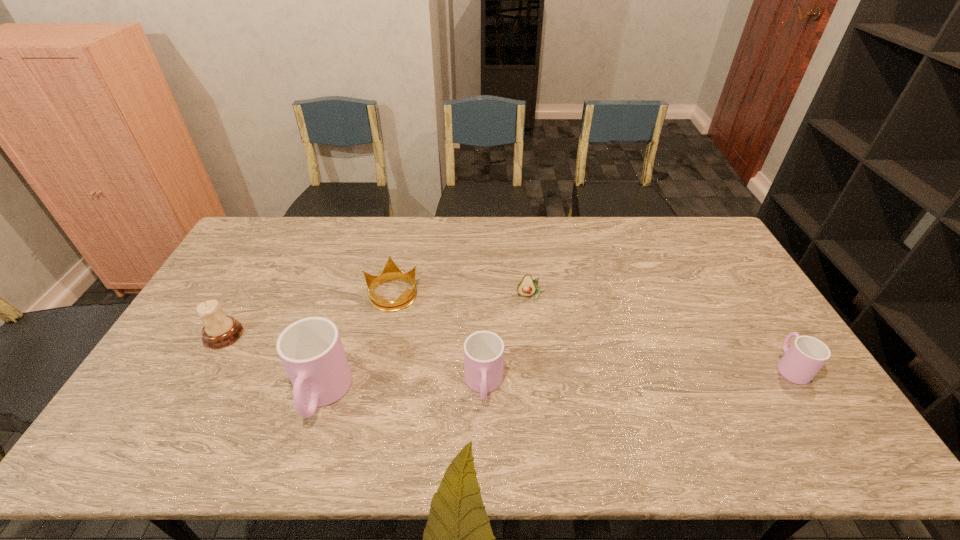
Where is `vacant region at the right edge of the desktop`? The image size is (960, 540). vacant region at the right edge of the desktop is located at coordinates (756, 308).

I want to click on vacant area that lies between the fourth object from left to right and the avocado, so click(x=507, y=341).

Find the location of `empty space between the second cup from right to left and the fifth object from left to right`. empty space between the second cup from right to left and the fifth object from left to right is located at coordinates coord(507,341).

The image size is (960, 540). Find the location of `vacant region between the tallest object and the candle holder`. vacant region between the tallest object and the candle holder is located at coordinates (273, 365).

Identify the location of free point between the second shortest cup and the leftmost cup. (402, 390).

You are a GUI agent. You are given a task and a screenshot of the screen. Output one action in this format:
    pyautogui.click(x=<x>, y=<y>)
    Task: Click on the free space between the second cup from right to left and the fifth object from left to right
    Image resolution: width=960 pixels, height=540 pixels.
    Given the screenshot: What is the action you would take?
    (507, 341)

Where is `vacant region between the avocado and the crown`? vacant region between the avocado and the crown is located at coordinates tap(462, 295).

You are a GUI agent. You are given a task and a screenshot of the screen. Output one action in this format:
    pyautogui.click(x=<x>, y=<y>)
    Task: Click on the free spot between the leftmost object and the crown
    This screenshot has height=540, width=960.
    Given the screenshot: What is the action you would take?
    pyautogui.click(x=308, y=314)

The height and width of the screenshot is (540, 960). Find the location of `vacant space that is in between the second cup from left to right and the tallest cup`. vacant space that is in between the second cup from left to right and the tallest cup is located at coordinates point(402,390).

You are a GUI agent. You are given a task and a screenshot of the screen. Output one action in this format:
    pyautogui.click(x=<x>, y=<y>)
    Task: Click on the vacant space that is in between the crown and the second shortest cup
    This screenshot has height=540, width=960.
    Given the screenshot: What is the action you would take?
    pyautogui.click(x=438, y=340)